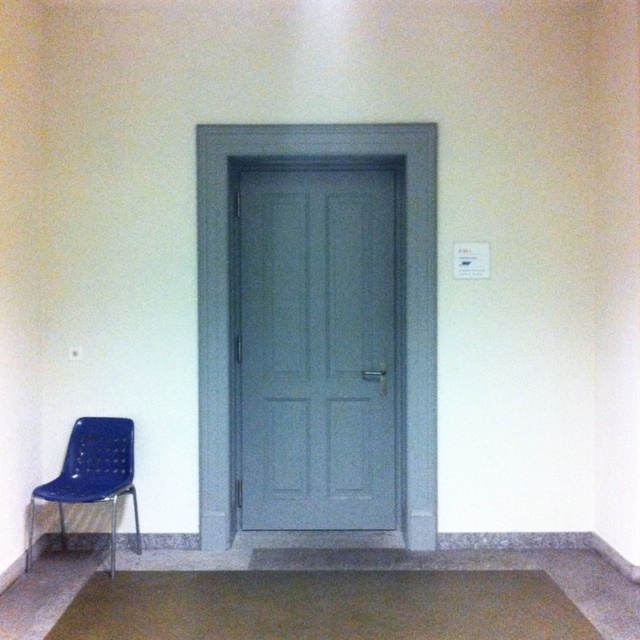
Question: Is matte gray door at center wider than brown textured mat at lower center?

Choices:
 (A) yes
 (B) no

Answer: (B)

Question: Which object appears closest to the camera in this image?

Choices:
 (A) brown textured mat at lower center
 (B) matte gray door at center
 (C) blue plastic chair at lower left

Answer: (A)

Question: Among these objects, which one is nearest to the camera?

Choices:
 (A) matte gray door at center
 (B) brown textured mat at lower center
 (C) blue plastic chair at lower left

Answer: (B)

Question: Does matte gray door at center have a larger size compared to blue plastic chair at lower left?

Choices:
 (A) no
 (B) yes

Answer: (A)

Question: Which of the following is the farthest from the observer?

Choices:
 (A) (122, 483)
 (B) (317, 593)
 (C) (257, 260)

Answer: (C)

Question: Where is brown textured mat at lower center located in relation to blue plastic chair at lower left in the image?

Choices:
 (A) right
 (B) left

Answer: (A)